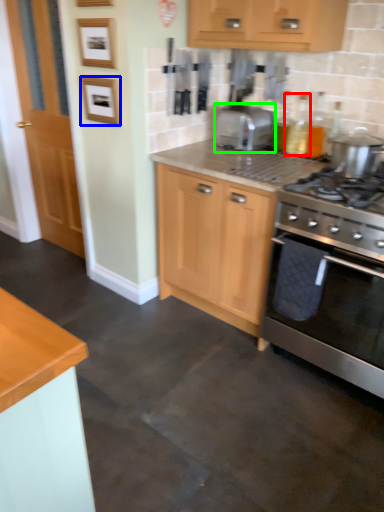
Question: Estimate the real-world distances between objects in this image. Which object is farther from bottle (highlighted by a red box), picture frame (highlighted by a blue box) or toaster (highlighted by a green box)?

Choices:
 (A) picture frame
 (B) toaster

Answer: (A)